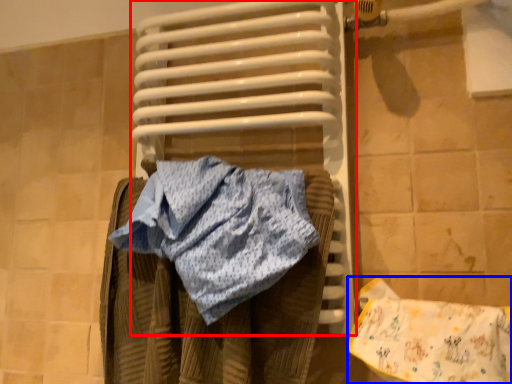
Question: Among these objects, which one is nearest to the camera, water heater (highlighted by a red box) or material (highlighted by a blue box)?

Choices:
 (A) water heater
 (B) material

Answer: (B)